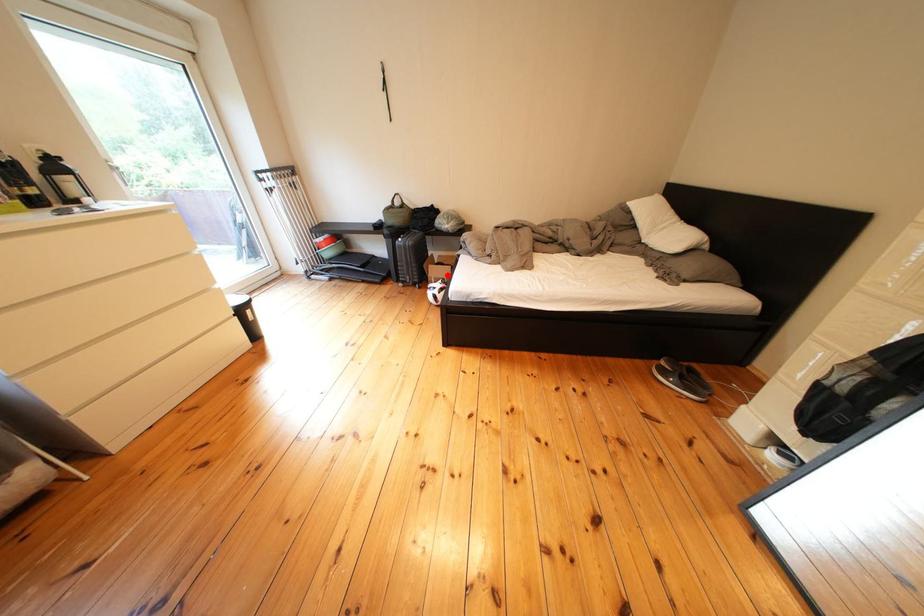
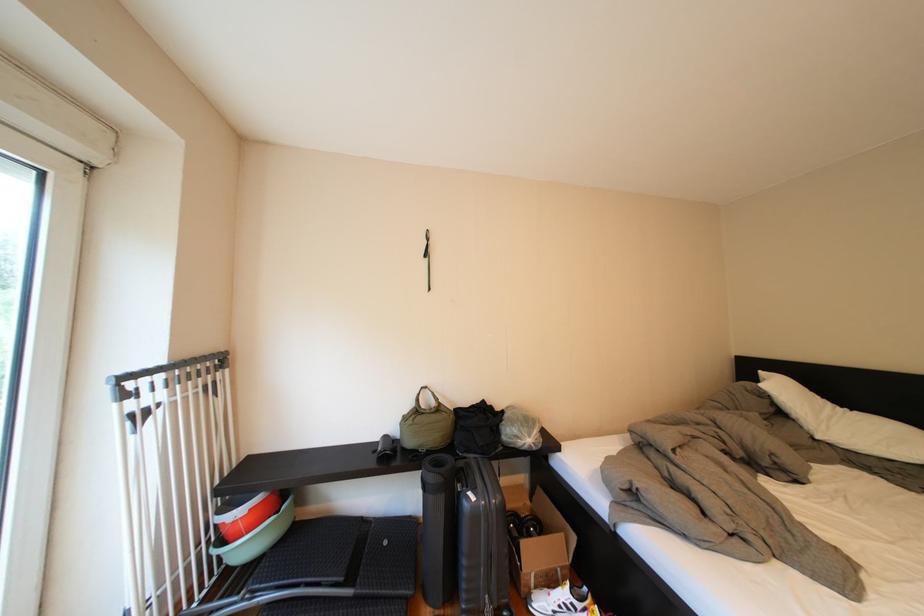
Locate, in the second image, the point that corresponds to the highlighted location in the first image.

(544, 557)